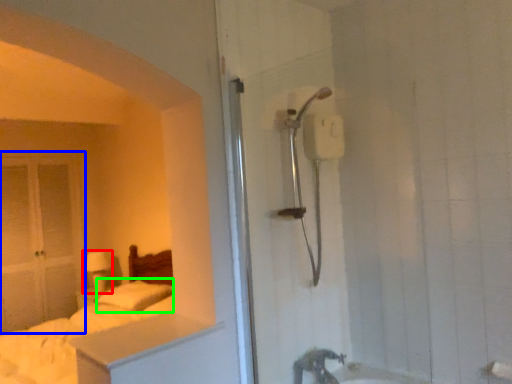
Question: Which is farther away from lamp (highlighted by a red box)? glass door (highlighted by a blue box) or pillow (highlighted by a green box)?

Choices:
 (A) glass door
 (B) pillow

Answer: (B)